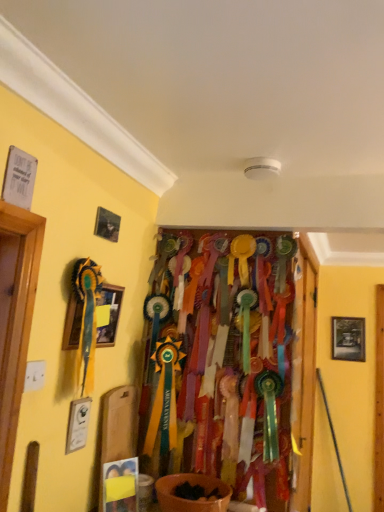
Question: Looking at the image, does wooden framed picture at left, arranged as the second picture frame when viewed from the back, seem bigger or smaller compared to wooden door at center?

Choices:
 (A) small
 (B) big

Answer: (A)

Question: Is point (81, 317) closer or farther from the camera than point (309, 342)?

Choices:
 (A) farther
 (B) closer

Answer: (B)

Question: Which is farther from the wooden framed picture at left, the 1th picture frame in the top-to-bottom sequence?

Choices:
 (A) wooden door at center
 (B) wooden framed picture at right, marked as the 1th picture frame in a bottom-to-top arrangement

Answer: (B)

Question: Estimate the real-world distances between objects in this image. Which object is farther from the wooden framed picture at left, arranged as the second picture frame when viewed from the back?

Choices:
 (A) wooden framed picture at right, which is the second picture frame in front-to-back order
 (B) wooden door at center

Answer: (A)